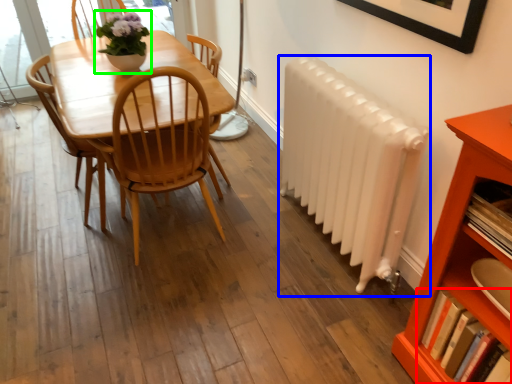
Question: Which object is positioned farthest from book (highlighted by a red box)? Select from radiator (highlighted by a blue box) and houseplant (highlighted by a green box).

Choices:
 (A) radiator
 (B) houseplant

Answer: (B)